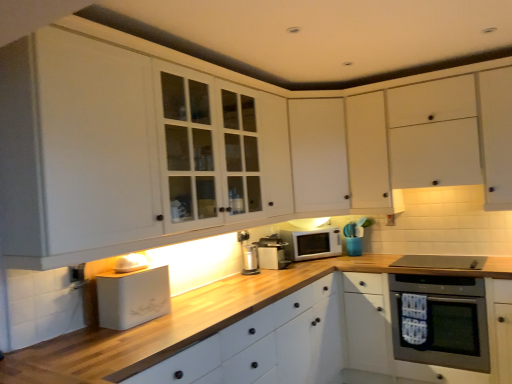
Question: In the image, is white glossy microwave at center positioned in front of or behind white matte drawer at lower center?

Choices:
 (A) front
 (B) behind

Answer: (B)

Question: In terms of height, does white glossy microwave at center look taller or shorter compared to white matte drawer at lower center?

Choices:
 (A) tall
 (B) short

Answer: (B)

Question: Which is nearer to the white matte bread bin at lower left, the third appliance viewed from the back?

Choices:
 (A) white matte drawer at lower center
 (B) white matte cabinet at upper center, the third cabinetry in the front-to-back sequence
 (C) wooden at lower center
 (D) stainless steel oven at lower right
 (E) satin silver thermos at lower center, positioned as the second appliance in back-to-front order

Answer: (C)

Question: Which object is the farthest from the white matte cabinet at upper right, the second cabinetry positioned from the front?

Choices:
 (A) satin silver thermos at lower center, positioned as the second appliance in back-to-front order
 (B) white plastic electric outlet at lower left
 (C) white matte bread bin at lower left, the first appliance from the left
 (D) stainless steel oven at lower right
 (E) white matte cabinet at center, the 1th cabinetry in the front-to-back sequence

Answer: (B)